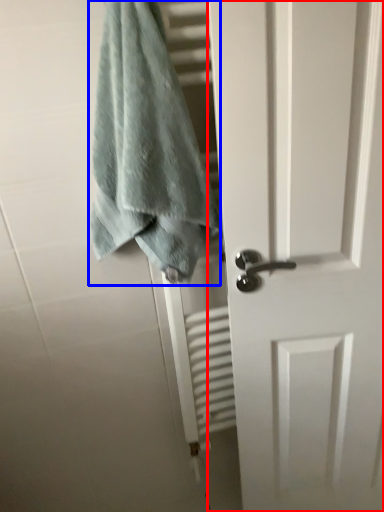
Question: Among these objects, which one is farthest to the camera, door (highlighted by a red box) or towel (highlighted by a blue box)?

Choices:
 (A) door
 (B) towel

Answer: (A)